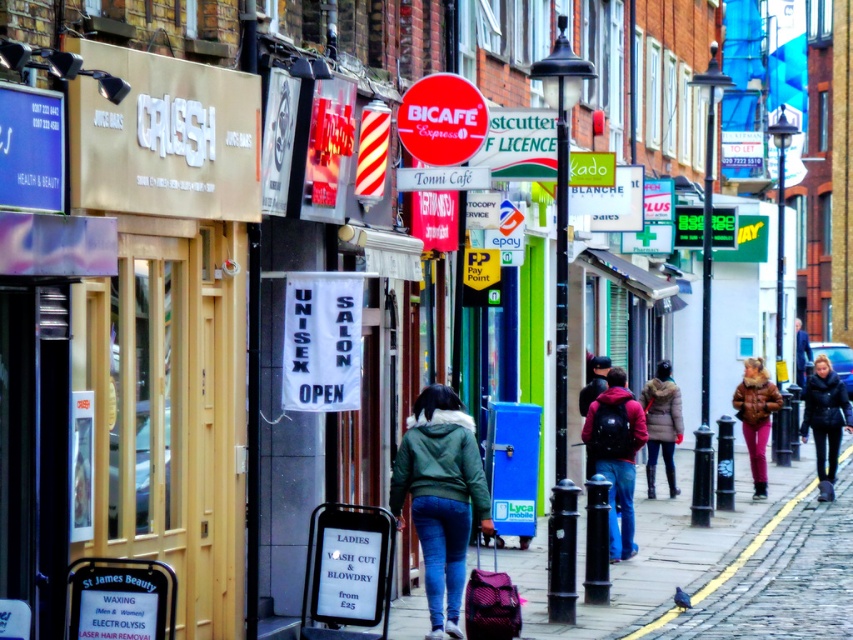
Is matte purple suitcase at lower center positioned in front of cobblestone pavement at lower right?

Yes, it is in front of cobblestone pavement at lower right.

What do you see at coordinates (490, 602) in the screenshot? I see `matte purple suitcase at lower center` at bounding box center [490, 602].

What are the coordinates of `matte purple suitcase at lower center` in the screenshot? It's located at (490, 602).

Locate an element on the screen. Image resolution: width=853 pixels, height=640 pixels. matte purple suitcase at lower center is located at coordinates (490, 602).

Is red matte backpack at center smaller than black leather jacket at right?

Correct, red matte backpack at center occupies less space than black leather jacket at right.

Which of these two, red matte backpack at center or black leather jacket at right, stands taller?

With more height is red matte backpack at center.

Find the location of a particular element. The height and width of the screenshot is (640, 853). red matte backpack at center is located at coordinates (616, 454).

Does green fuzzy jacket at center lie behind red matte backpack at center?

No, it is not.

Does green fuzzy jacket at center have a lesser width compared to red matte backpack at center?

In fact, green fuzzy jacket at center might be wider than red matte backpack at center.

Is point (468, 515) less distant than point (590, 413)?

That is True.

I want to click on green fuzzy jacket at center, so click(440, 497).